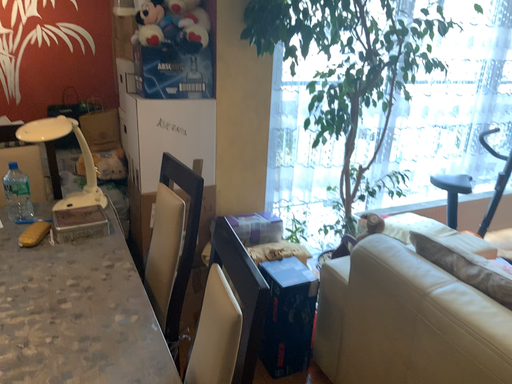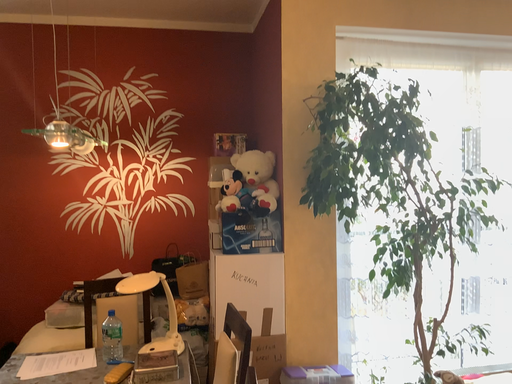
Question: How did the camera likely rotate when shooting the video?

Choices:
 (A) rotated downward
 (B) rotated upward

Answer: (B)